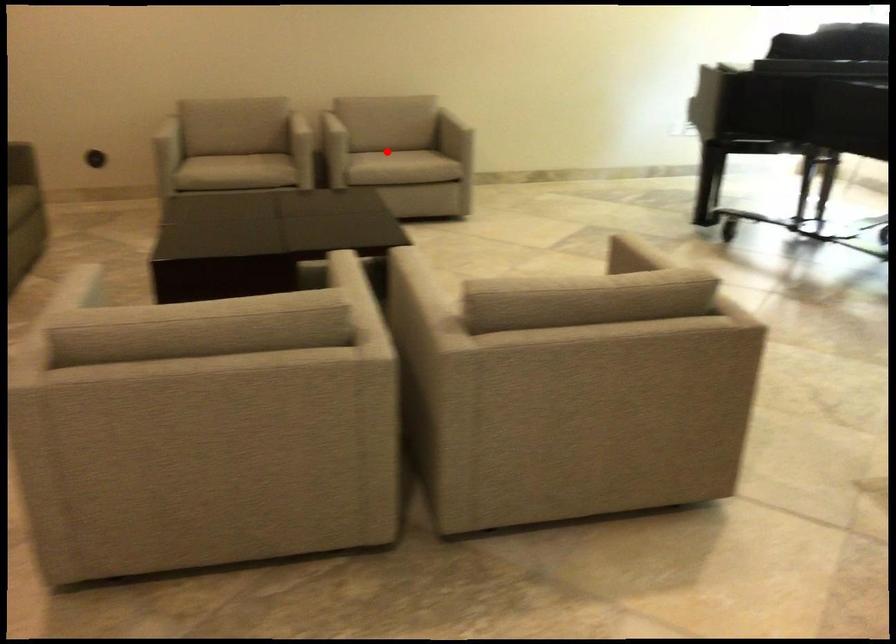
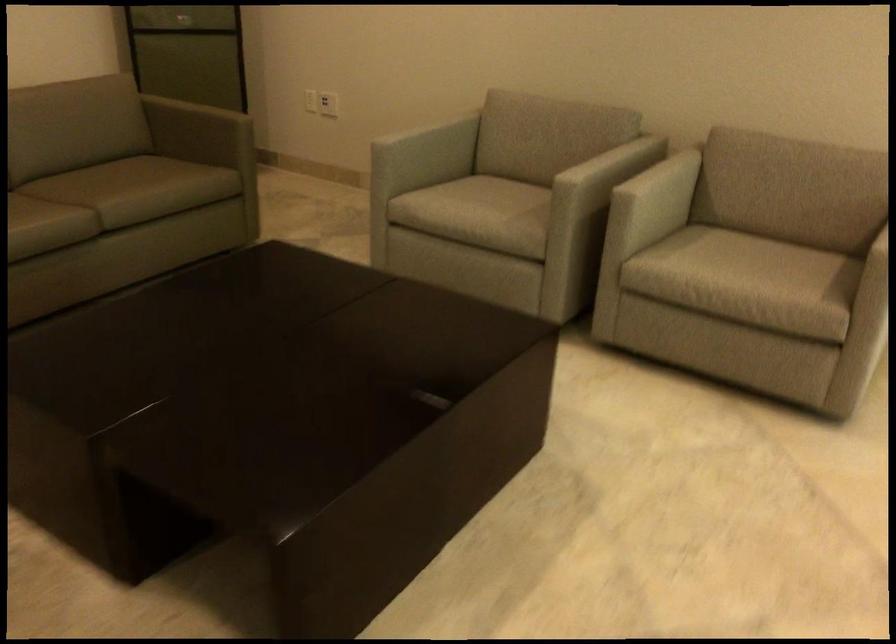
Find the pixel in the second image that matches the highlighted location in the first image.

(739, 257)